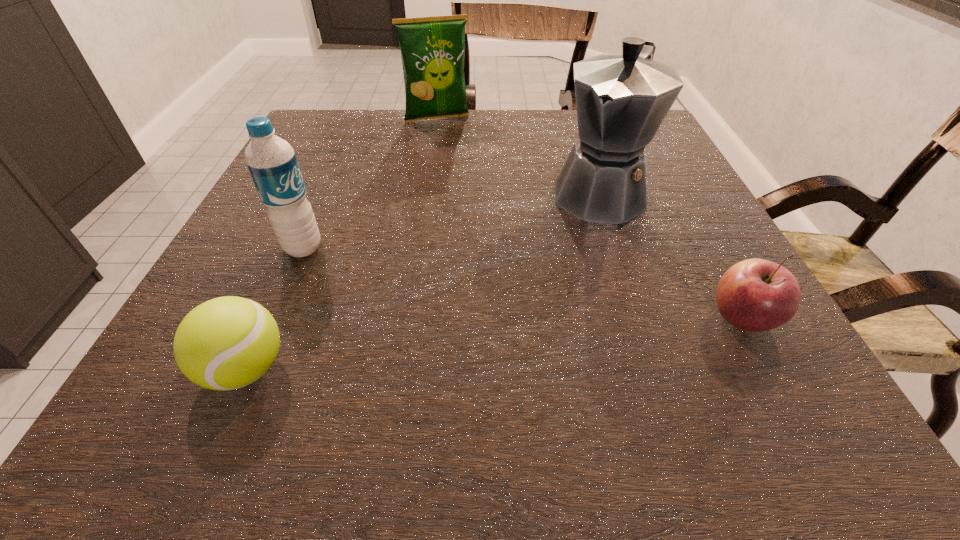
Where is `vacant region at the right edge of the desktop`? This screenshot has height=540, width=960. vacant region at the right edge of the desktop is located at coordinates (677, 197).

Locate an element on the screen. The image size is (960, 540). free space at the far left corner of the desktop is located at coordinates (349, 155).

This screenshot has height=540, width=960. I want to click on vacant space that's between the tennis ball and the third farthest object, so click(x=275, y=308).

The width and height of the screenshot is (960, 540). In order to click on free space between the farthest object and the second farthest object in this screenshot , I will do `click(517, 155)`.

Locate an element on the screen. This screenshot has width=960, height=540. free space between the water bottle and the rightmost object is located at coordinates coord(522,283).

This screenshot has width=960, height=540. I want to click on empty location between the apple and the tallest object, so click(669, 255).

Where is `vacant space that is in between the water bottle and the fourth nearest object`? vacant space that is in between the water bottle and the fourth nearest object is located at coordinates (450, 220).

Locate an element on the screen. Image resolution: width=960 pixels, height=540 pixels. free spot between the third farthest object and the crisp (potato chip) is located at coordinates (371, 183).

Where is `free point between the coffeepot and the crisp (potato chip)`? free point between the coffeepot and the crisp (potato chip) is located at coordinates (517, 155).

Identify the location of empty space that is in between the tallest object and the water bottle. The width and height of the screenshot is (960, 540). (450, 220).